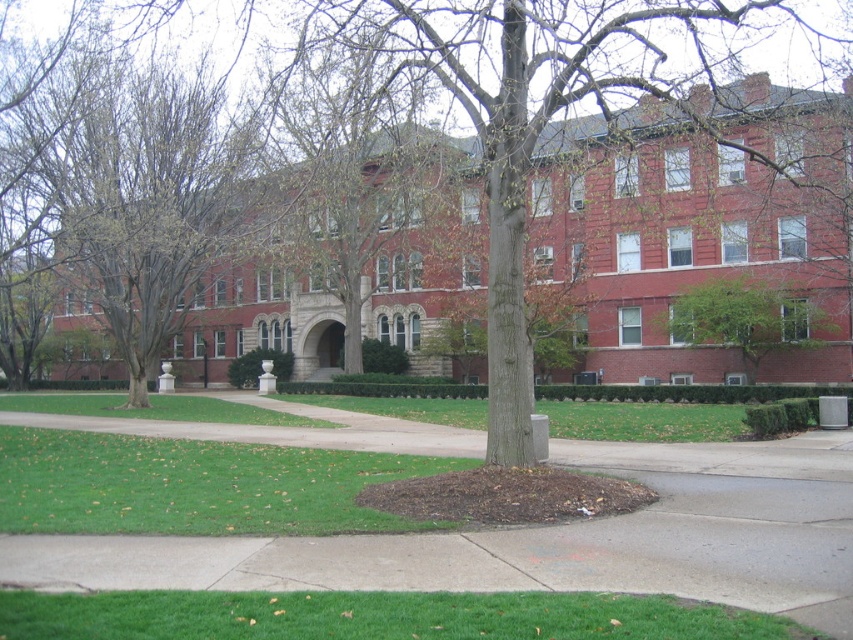
You are standing at the entrance of the large red brick building and want to take a photo. There are two points marked in the scene, point (689, 602) and point (799, 330). Which point will appear larger in the photo?

Point (689, 602) is closer to the camera than point (799, 330). Since objects closer to the camera appear larger in a photo, point (689, 602) will appear larger in the photo.

You are standing on the lawn and want to walk to the building entrance. Which direction should you go to avoid the green leafy tree at center while staying on the green grass at lower center?

The green grass at lower center is positioned under the green leafy tree at center, so to avoid the tree while staying on the grass, you should walk towards the building entrance while staying on the green grass at lower center, which is located under the tree.